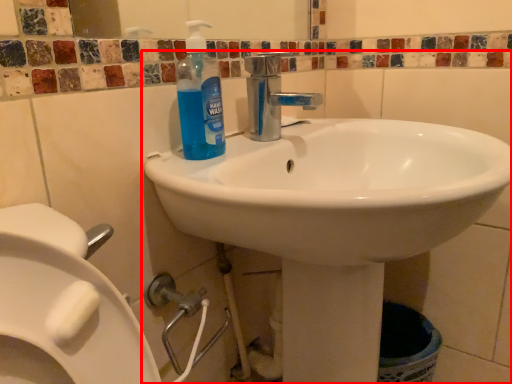
Question: Where is sink (annotated by the red box) located in relation to cleaning product in the image?

Choices:
 (A) left
 (B) right

Answer: (B)